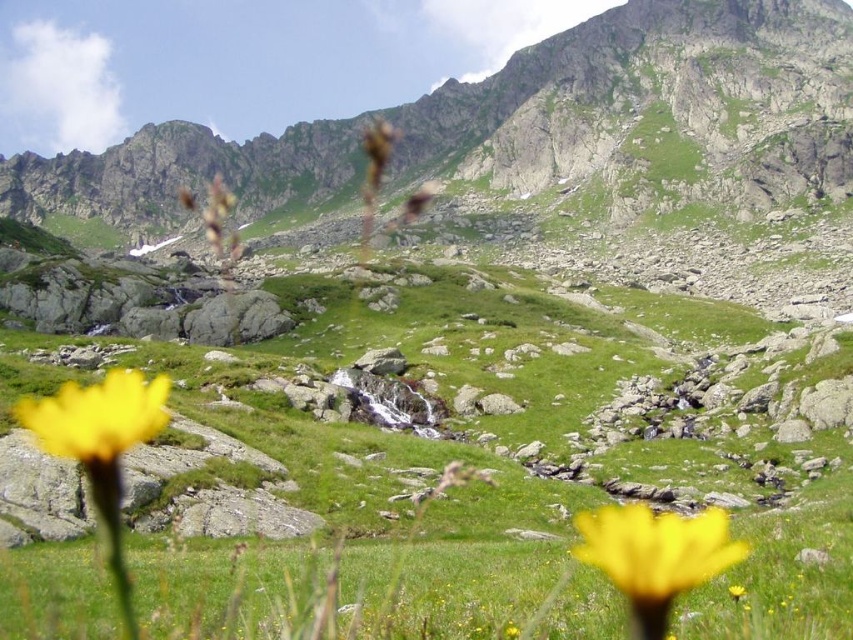
Question: Which of these objects is positioned farthest from the green rocky mountain at upper center?

Choices:
 (A) bright yellow flower at lower left
 (B) yellow matte flower at lower right

Answer: (B)

Question: From the image, what is the correct spatial relationship of yellow matte flower at lower right in relation to yellow matte flower at lower center?

Choices:
 (A) above
 (B) below

Answer: (B)

Question: Can you confirm if green rocky mountain at upper center is bigger than yellow matte flower at lower right?

Choices:
 (A) no
 (B) yes

Answer: (B)

Question: Which point is closer to the camera?

Choices:
 (A) yellow matte flower at lower center
 (B) yellow matte flower at lower right
 (C) bright yellow flower at lower left

Answer: (A)

Question: Is bright yellow flower at lower left positioned in front of yellow matte flower at lower center?

Choices:
 (A) yes
 (B) no

Answer: (B)

Question: Which point is farther from the camera taking this photo?

Choices:
 (A) (735, 593)
 (B) (672, 538)
 (C) (13, 412)

Answer: (C)